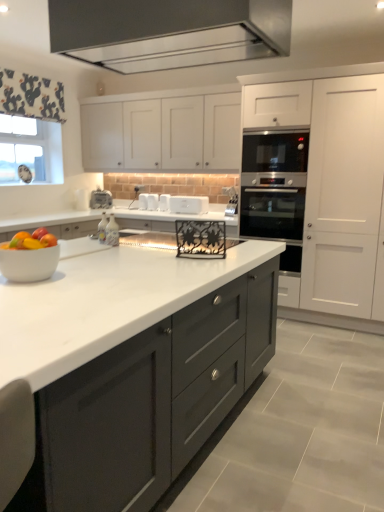
Find the location of `white matte cabinet at right, arranged as the first cabinetry when viewed from the right`. white matte cabinet at right, arranged as the first cabinetry when viewed from the right is located at coordinates (335, 191).

Describe the element at coordinates (168, 32) in the screenshot. I see `satin metallic exhaust hood at upper center` at that location.

Where is `white matte cabinet at right, arranged as the first cabinetry when viewed from the right`? This screenshot has height=512, width=384. white matte cabinet at right, arranged as the first cabinetry when viewed from the right is located at coordinates (335, 191).

Where is `the 4th appliance to the right when counting from the clear glass window screen at upper left`? This screenshot has height=512, width=384. the 4th appliance to the right when counting from the clear glass window screen at upper left is located at coordinates (164, 202).

Which of these two, white glossy toaster at center, the 2th appliance from the right, or clear glass window screen at upper left, is thinner?

clear glass window screen at upper left.

From the image's perspective, between white glossy toaster at center, the fourth appliance in the left-to-right sequence, and clear glass window screen at upper left, who is located below?

From the image's view, white glossy toaster at center, the fourth appliance in the left-to-right sequence, is below.

How many degrees apart are the facing directions of white glossy toaster at center, the fourth appliance in the left-to-right sequence, and clear glass window screen at upper left?

The facing directions of white glossy toaster at center, the fourth appliance in the left-to-right sequence, and clear glass window screen at upper left are 88.6 degrees apart.

Can you confirm if white plastic toaster at center, the 5th appliance from the right, is thinner than satin metallic exhaust hood at upper center?

Correct, the width of white plastic toaster at center, the 5th appliance from the right, is less than that of satin metallic exhaust hood at upper center.

From a real-world perspective, between white plastic toaster at center, arranged as the 1th appliance when viewed from the left, and satin metallic exhaust hood at upper center, who is vertically lower?

white plastic toaster at center, arranged as the 1th appliance when viewed from the left, is physically lower.

Is white plastic toaster at center, arranged as the 1th appliance when viewed from the left, positioned with its back to satin metallic exhaust hood at upper center?

No, white plastic toaster at center, arranged as the 1th appliance when viewed from the left,'s orientation is not away from satin metallic exhaust hood at upper center.

Which of these two, white plastic toaster at center, the 5th appliance from the right, or satin metallic exhaust hood at upper center, stands taller?

Standing taller between the two is satin metallic exhaust hood at upper center.

Consider the image. Between shiny plastic bowl of mixed fruits at center-left and white plastic toaster at center, the 5th appliance from the right, which one is positioned behind?

white plastic toaster at center, the 5th appliance from the right, is further from the camera.

Does point (42, 228) come closer to viewer compared to point (102, 208)?

Yes.

From the image's perspective, which one is positioned higher, shiny plastic bowl of mixed fruits at center-left or white plastic toaster at center, arranged as the 1th appliance when viewed from the left?

white plastic toaster at center, arranged as the 1th appliance when viewed from the left, from the image's perspective.

How different are the orientations of satin metallic exhaust hood at upper center and clear glass window screen at upper left in degrees?

The angle between the facing direction of satin metallic exhaust hood at upper center and the facing direction of clear glass window screen at upper left is 89.5 degrees.

Could you tell me if satin metallic exhaust hood at upper center is turned towards clear glass window screen at upper left?

No, satin metallic exhaust hood at upper center does not turn towards clear glass window screen at upper left.

Which is closer, (100, 25) or (10, 128)?

Point (100, 25) appears to be closer to the viewer than point (10, 128).

Looking at their sizes, would you say satin metallic exhaust hood at upper center is wider or thinner than clear glass window screen at upper left?

In the image, satin metallic exhaust hood at upper center appears to be wider than clear glass window screen at upper left.

Which object is further away from the camera taking this photo, white matte cabinet at right, arranged as the first cabinetry when viewed from the right, or white matte cabinet at upper center, the 1th cabinetry from the left?

white matte cabinet at upper center, the 1th cabinetry from the left, is further away from the camera.

Can you confirm if white matte cabinet at right, placed as the 2th cabinetry when sorted from left to right, is smaller than white matte cabinet at upper center, the 1th cabinetry from the left?

No, white matte cabinet at right, placed as the 2th cabinetry when sorted from left to right, is not smaller than white matte cabinet at upper center, the 1th cabinetry from the left.

Is point (350, 163) farther from camera compared to point (112, 135)?

No, (350, 163) is in front of (112, 135).

Can you tell me how much white matte cabinet at right, placed as the 2th cabinetry when sorted from left to right, and white matte cabinet at upper center, the 1th cabinetry from the left, differ in facing direction?

The facing directions of white matte cabinet at right, placed as the 2th cabinetry when sorted from left to right, and white matte cabinet at upper center, the 1th cabinetry from the left, are 0.152 degrees apart.

Considering the positions of objects white matte cabinet at right, placed as the 2th cabinetry when sorted from left to right, and white marble countertop at center in the image provided, who is more to the left, white matte cabinet at right, placed as the 2th cabinetry when sorted from left to right, or white marble countertop at center?

Positioned to the left is white marble countertop at center.

From the image's perspective, which one is positioned lower, white matte cabinet at right, placed as the 2th cabinetry when sorted from left to right, or white marble countertop at center?

white marble countertop at center, from the image's perspective.

Which point is more distant from viewer, (x=370, y=140) or (x=84, y=456)?

The point (x=370, y=140) is farther.

Is white matte cabinet at right, arranged as the first cabinetry when viewed from the right, facing towards white marble countertop at center?

Yes, white matte cabinet at right, arranged as the first cabinetry when viewed from the right, is facing white marble countertop at center.

Who is shorter, white fabric at upper left or white plastic toaster at center, the 5th appliance from the right?

With less height is white plastic toaster at center, the 5th appliance from the right.

Can you confirm if white fabric at upper left is smaller than white plastic toaster at center, the 5th appliance from the right?

No.

From a real-world perspective, which object rests below the other?

white plastic toaster at center, the 5th appliance from the right.

At what (x,y) coordinates should I click in order to perform the action: click on appliance that is the 4th object to the right of the clear glass window screen at upper left, starting at the anchor. Please return your answer as a coordinate pair (x, y). This screenshot has width=384, height=512. Looking at the image, I should click on (164, 202).

Locate an element on the screen. The height and width of the screenshot is (512, 384). exhaust hood in front of the white plastic toaster at center, the 5th appliance from the right is located at coordinates (168, 32).

From the image, which object appears to be farther from white matte cabinet at right, placed as the 2th cabinetry when sorted from left to right, satin silver oven at center-right or shiny plastic bowl of mixed fruits at center-left?

Among the two, shiny plastic bowl of mixed fruits at center-left is located further to white matte cabinet at right, placed as the 2th cabinetry when sorted from left to right.

Looking at the image, which one is located further to shiny plastic bowl of mixed fruits at center-left, clear glass window screen at upper left or white plastic toaster at center, arranged as the 1th appliance when viewed from the left?

Based on the image, clear glass window screen at upper left appears to be further to shiny plastic bowl of mixed fruits at center-left.

From the image, which object appears to be farther from satin metallic exhaust hood at upper center, white glossy toaster at center, the 5th appliance from the left, or white matte toaster at center, arranged as the third appliance when viewed from the right?

white matte toaster at center, arranged as the third appliance when viewed from the right, is positioned further to the anchor satin metallic exhaust hood at upper center.

When comparing their distances from satin silver oven at center-right, does white matte cabinet at upper center, the second cabinetry from the right, or white marble countertop at center seem closer?

Based on the image, white matte cabinet at upper center, the second cabinetry from the right, appears to be nearer to satin silver oven at center-right.

When comparing their distances from satin silver oven at center-right, does white glossy toaster at center, the 2th appliance from the right, or clear glass window screen at upper left seem closer?

white glossy toaster at center, the 2th appliance from the right, is closer to satin silver oven at center-right.

Estimate the real-world distances between objects in this image. Which object is closer to shiny plastic bowl of mixed fruits at center-left, white plastic toaster at center, arranged as the 1th appliance when viewed from the left, or satin metallic exhaust hood at upper center?

white plastic toaster at center, arranged as the 1th appliance when viewed from the left, is closer to shiny plastic bowl of mixed fruits at center-left.

Based on their spatial positions, is shiny plastic bowl of mixed fruits at center-left or clear glass window screen at upper left further from white matte cabinet at upper center, the second cabinetry from the right?

shiny plastic bowl of mixed fruits at center-left.

From the image, which object appears to be farther from satin silver oven at center-right, shiny plastic bowl of mixed fruits at center-left or white glossy toaster at center, the 5th appliance from the left?

shiny plastic bowl of mixed fruits at center-left lies further to satin silver oven at center-right than the other object.

Where is `cabinetry between clear glass window screen at upper left and satin silver oven at center-right`? Image resolution: width=384 pixels, height=512 pixels. cabinetry between clear glass window screen at upper left and satin silver oven at center-right is located at coordinates click(163, 134).

Find the location of `oven between satin metallic exhaust hood at upper center and white glossy toaster at center, which is the 1th appliance from right to left, from front to back`. oven between satin metallic exhaust hood at upper center and white glossy toaster at center, which is the 1th appliance from right to left, from front to back is located at coordinates (275, 190).

You are a GUI agent. You are given a task and a screenshot of the screen. Output one action in this format:
    pyautogui.click(x=<x>, y=<y>)
    Task: Click on the curtain situated between clear glass window screen at upper left and white matte cabinet at upper center, the second cabinetry from the right, from left to right
    The height and width of the screenshot is (512, 384).
    Given the screenshot: What is the action you would take?
    pyautogui.click(x=31, y=96)

At what (x,y) coordinates should I click in order to perform the action: click on cabinetry between white matte cabinet at right, placed as the 2th cabinetry when sorted from left to right, and white glossy toaster at center, the 2th appliance from the right, in the front-back direction. Please return your answer as a coordinate pair (x, y). Image resolution: width=384 pixels, height=512 pixels. Looking at the image, I should click on (163, 134).